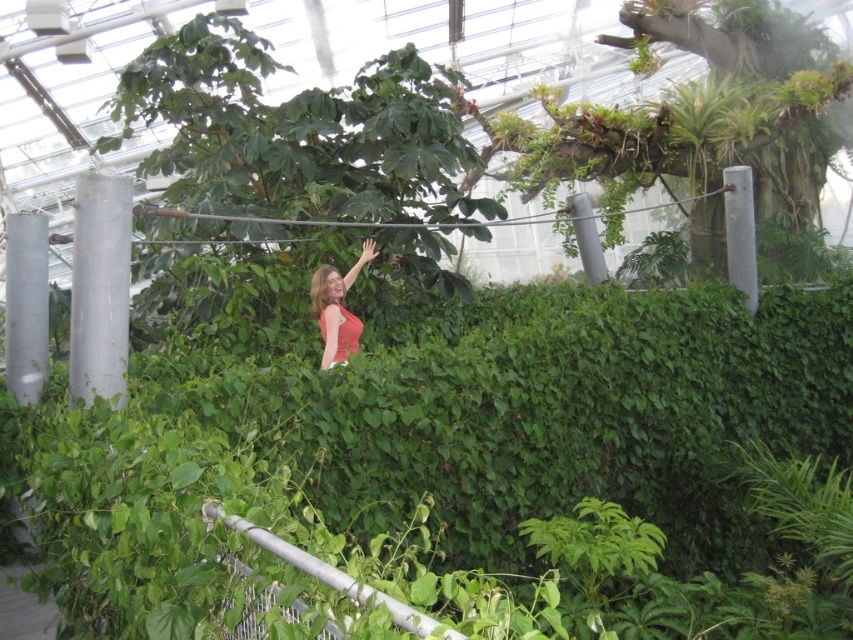
You are a visitor in the indoor garden and want to take a photo of the matte red dress at center without the silver metallic rail at center appearing in the frame. Can you step back enough to do so?

The silver metallic rail at center is 3.65 meters away from the matte red dress at center. To avoid the rail in the photo, you need to position yourself far enough so that the rail is out of the camera frame while keeping the dress in view. However, since both objects are 3.65 meters apart, it might be challenging to frame the dress without including the rail unless you have a zoom lens or adjust your angle significantly.

You are standing in the indoor garden and want to place two markers at the specified points. Which point, point (287, 416) or point (357, 346), is closer to you?

Point (287, 416) is closer to the viewer than point (357, 346).

From the picture: You are a gardener who needs to place a 3 feet wide decorative planter between the green leafy hedge at center and the silver metallic rail at center. Will there be enough space to fit the planter without overlapping either object?

The distance between the green leafy hedge at center and the silver metallic rail at center is 9.17 feet. Since the planter is only 3 feet wide, there is sufficient space to place it between them without overlapping either object.